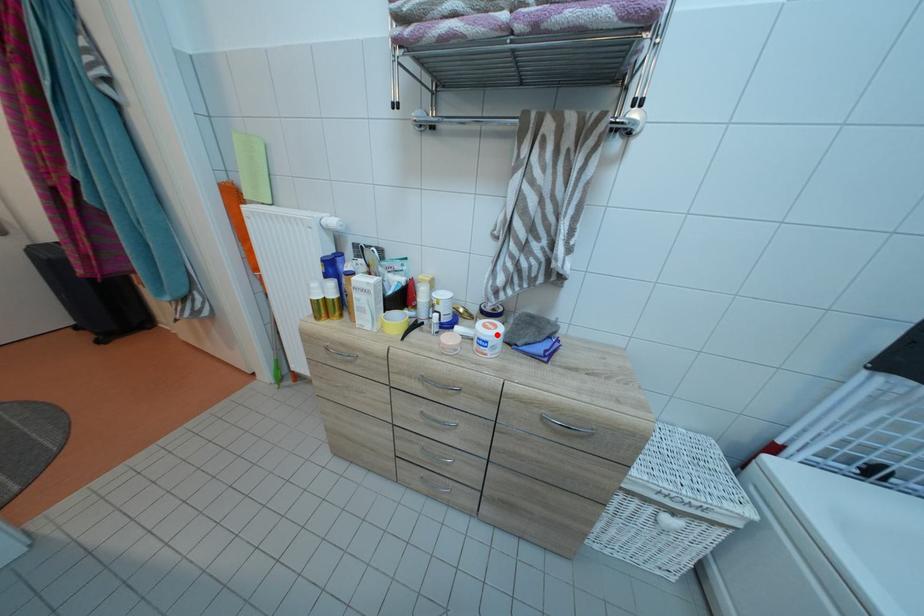
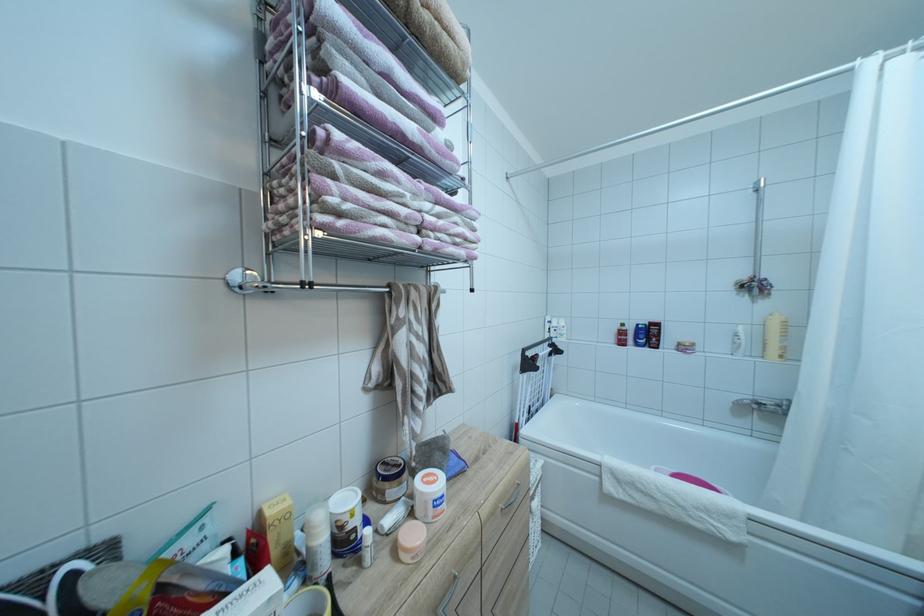
The point at the highlighted location is marked in the first image. Where is the corresponding point in the second image?

(442, 487)